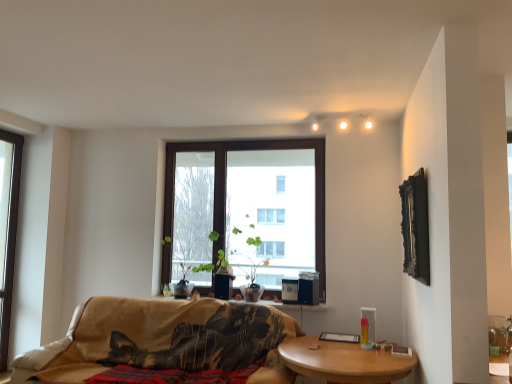
Question: Can you confirm if beige fabric couch at center is thinner than velvet black blanket at center?

Choices:
 (A) no
 (B) yes

Answer: (A)

Question: Does beige fabric couch at center have a larger size compared to velvet black blanket at center?

Choices:
 (A) yes
 (B) no

Answer: (A)

Question: From a real-world perspective, is beige fabric couch at center located beneath velvet black blanket at center?

Choices:
 (A) no
 (B) yes

Answer: (A)

Question: Can you confirm if beige fabric couch at center is smaller than velvet black blanket at center?

Choices:
 (A) yes
 (B) no

Answer: (B)

Question: Is beige fabric couch at center positioned far away from velvet black blanket at center?

Choices:
 (A) no
 (B) yes

Answer: (A)

Question: From the image's perspective, is beige fabric couch at center located above velvet black blanket at center?

Choices:
 (A) yes
 (B) no

Answer: (A)

Question: Does velvet black blanket at center have a smaller size compared to clear glass window at left, marked as the second window in a right-to-left arrangement?

Choices:
 (A) yes
 (B) no

Answer: (B)

Question: Does velvet black blanket at center turn towards clear glass window at left, which is the first window in left-to-right order?

Choices:
 (A) yes
 (B) no

Answer: (B)

Question: Is clear glass window at left, which is the first window in left-to-right order, located within velvet black blanket at center?

Choices:
 (A) yes
 (B) no

Answer: (B)

Question: From the image's perspective, is velvet black blanket at center beneath clear glass window at left, which is the first window in left-to-right order?

Choices:
 (A) no
 (B) yes

Answer: (B)

Question: From the image's perspective, is velvet black blanket at center above clear glass window at left, which is the first window in left-to-right order?

Choices:
 (A) no
 (B) yes

Answer: (A)

Question: Is velvet black blanket at center outside of clear glass window at left, marked as the second window in a right-to-left arrangement?

Choices:
 (A) yes
 (B) no

Answer: (A)

Question: Considering the relative positions of wooden at lower right and matte white light bulb at upper center in the image provided, is wooden at lower right to the left of matte white light bulb at upper center from the viewer's perspective?

Choices:
 (A) yes
 (B) no

Answer: (A)